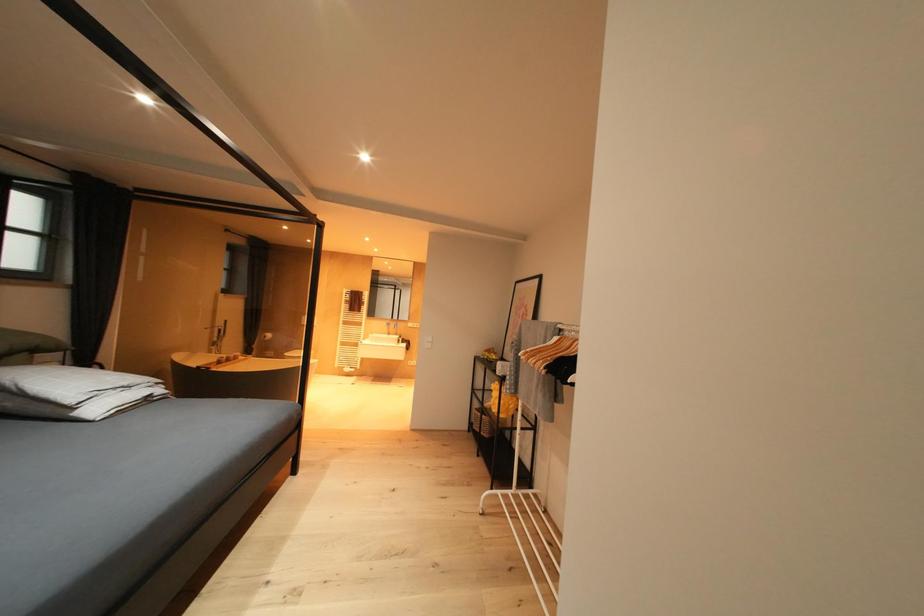
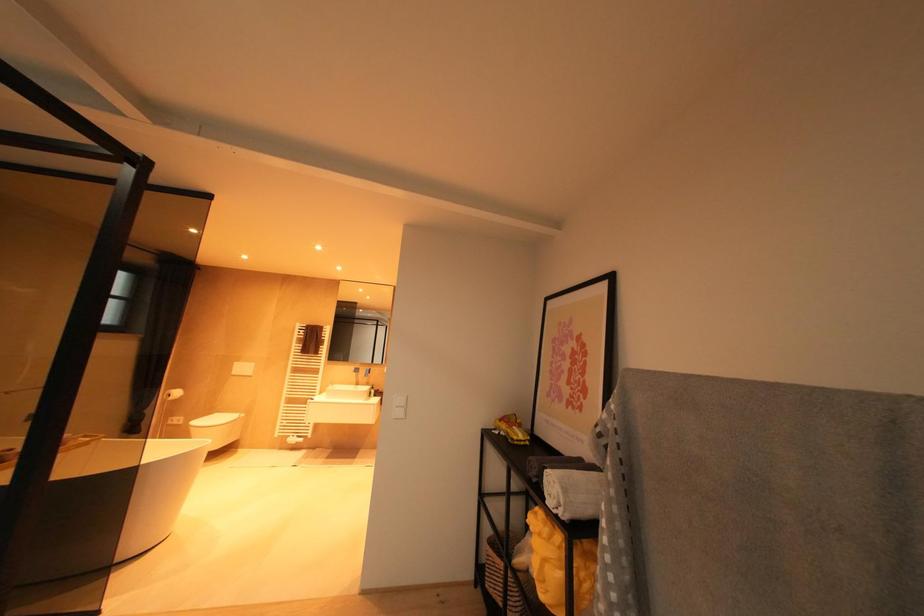
Question: What movement of the cameraman would produce the second image?

Choices:
 (A) Left
 (B) Right
 (C) Forward
 (D) Backward

Answer: (C)